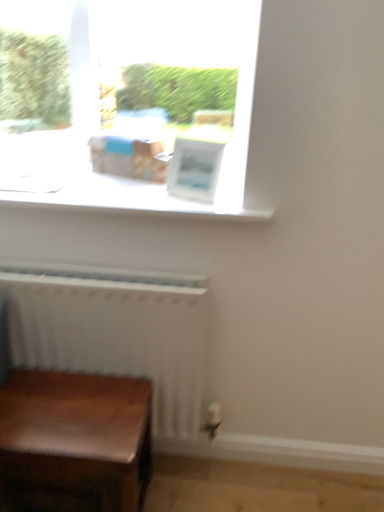
What do you see at coordinates (77, 436) in the screenshot?
I see `wooden table at lower left` at bounding box center [77, 436].

Image resolution: width=384 pixels, height=512 pixels. Describe the element at coordinates (112, 197) in the screenshot. I see `white matte window sill at upper center` at that location.

Find the location of a particular element. The image size is (384, 512). wooden table at lower left is located at coordinates (77, 436).

From a real-world perspective, who is located lower, white matte radiator at lower left or white matte window sill at upper center?

A: white matte radiator at lower left.

From the image's perspective, is white matte radiator at lower left above or below white matte window sill at upper center?

Based on their image positions, white matte radiator at lower left is located beneath white matte window sill at upper center.

Could you tell me if white matte radiator at lower left is turned towards white matte window sill at upper center?

No, white matte radiator at lower left is not facing towards white matte window sill at upper center.

Is wooden table at lower left positioned with its back to white matte window sill at upper center?

No, white matte window sill at upper center is not at the back of wooden table at lower left.

In the scene shown: From the image's perspective, which one is positioned higher, wooden table at lower left or white matte window sill at upper center?

white matte window sill at upper center appears higher in the image.

Considering the positions of objects wooden table at lower left and white matte window sill at upper center in the image provided, who is more to the right, wooden table at lower left or white matte window sill at upper center?

From the viewer's perspective, white matte window sill at upper center appears more on the right side.

Is wooden table at lower left looking in the opposite direction of white matte radiator at lower left?

That's right, wooden table at lower left is facing away from white matte radiator at lower left.

Is wooden table at lower left directly adjacent to white matte radiator at lower left?

No, wooden table at lower left is not in contact with white matte radiator at lower left.

Is point (105, 496) closer or farther from the camera than point (151, 319)?

Point (105, 496) appears to be closer to the viewer than point (151, 319).

Is point (155, 285) closer or farther from the camera than point (114, 470)?

Clearly, point (155, 285) is more distant from the camera than point (114, 470).

From the image's perspective, which one is positioned higher, white matte radiator at lower left or wooden table at lower left?

white matte radiator at lower left is shown above in the image.

From a real-world perspective, between white matte radiator at lower left and wooden table at lower left, who is vertically higher?

In real-world perspective, white matte radiator at lower left is above.

Is white matte radiator at lower left to the right of wooden table at lower left from the viewer's perspective?

Correct, you'll find white matte radiator at lower left to the right of wooden table at lower left.

In terms of width, does white matte window sill at upper center look wider or thinner when compared to wooden table at lower left?

In the image, white matte window sill at upper center appears to be wider than wooden table at lower left.

How distant is white matte window sill at upper center from wooden table at lower left?

They are 24.77 inches apart.

Is wooden table at lower left a part of white matte window sill at upper center?

That's incorrect, wooden table at lower left is not inside white matte window sill at upper center.

Which is in front, white matte window sill at upper center or wooden table at lower left?

wooden table at lower left is more forward.

Between white matte window sill at upper center and white matte radiator at lower left, which one appears on the right side from the viewer's perspective?

From the viewer's perspective, white matte window sill at upper center appears more on the right side.

Considering the relative sizes of white matte window sill at upper center and white matte radiator at lower left in the image provided, is white matte window sill at upper center smaller than white matte radiator at lower left?

Correct, white matte window sill at upper center occupies less space than white matte radiator at lower left.

From a real-world perspective, who is located higher, white matte window sill at upper center or white matte radiator at lower left?

white matte window sill at upper center.

Is white matte window sill at upper center wider or thinner than white matte radiator at lower left?

In the image, white matte window sill at upper center appears to be wider than white matte radiator at lower left.

You are a GUI agent. You are given a task and a screenshot of the screen. Output one action in this format:
    pyautogui.click(x=<x>, y=<y>)
    Task: Click on the window sill located on the right of white matte radiator at lower left
    The image size is (384, 512).
    Given the screenshot: What is the action you would take?
    pyautogui.click(x=112, y=197)

Where is `table that appears below the white matte window sill at upper center (from the image's perspective)`? This screenshot has width=384, height=512. table that appears below the white matte window sill at upper center (from the image's perspective) is located at coordinates (77, 436).

Looking at the image, which one is located further to white matte radiator at lower left, wooden table at lower left or white matte window sill at upper center?

Among the two, white matte window sill at upper center is located further to white matte radiator at lower left.

Looking at the image, which one is located further to white matte radiator at lower left, white matte window sill at upper center or wooden table at lower left?

Based on the image, white matte window sill at upper center appears to be further to white matte radiator at lower left.

Based on their spatial positions, is wooden table at lower left or white matte radiator at lower left further from white matte window sill at upper center?

Based on the image, wooden table at lower left appears to be further to white matte window sill at upper center.

Looking at the image, which one is located closer to wooden table at lower left, white matte radiator at lower left or white matte window sill at upper center?

white matte radiator at lower left.

Looking at the image, which one is located further to wooden table at lower left, white matte window sill at upper center or white matte radiator at lower left?

white matte window sill at upper center is positioned further to the anchor wooden table at lower left.

When comparing their distances from white matte window sill at upper center, does white matte radiator at lower left or wooden table at lower left seem further?

The object further to white matte window sill at upper center is wooden table at lower left.

The width and height of the screenshot is (384, 512). I want to click on radiator between white matte window sill at upper center and wooden table at lower left vertically, so coord(115,332).